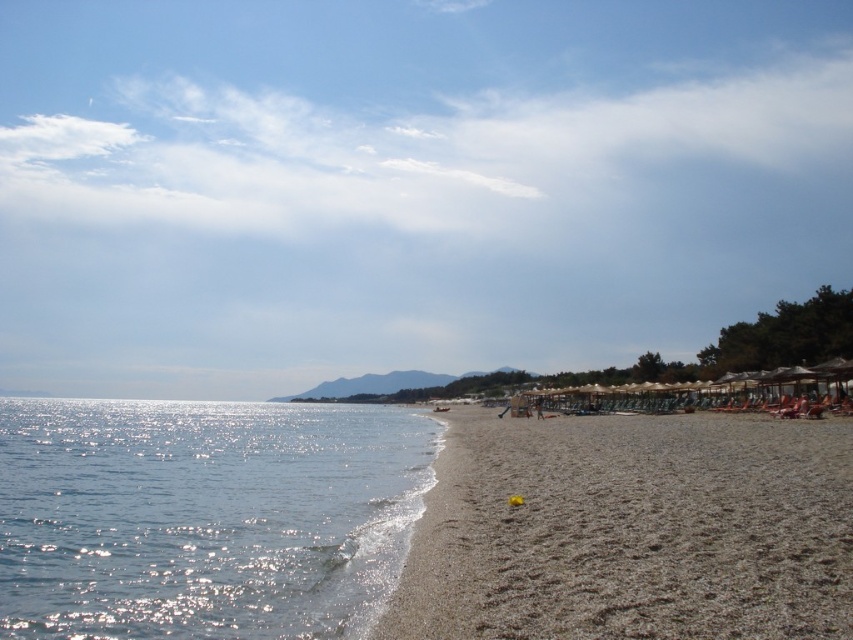
Question: Does blue sky at upper center have a larger size compared to shiny blue water at lower left?

Choices:
 (A) yes
 (B) no

Answer: (A)

Question: Is shiny blue water at lower left bigger than brown sandy beach at lower right?

Choices:
 (A) yes
 (B) no

Answer: (A)

Question: Can you confirm if blue sky at upper center is positioned above shiny blue water at lower left?

Choices:
 (A) no
 (B) yes

Answer: (B)

Question: Estimate the real-world distances between objects in this image. Which object is farther from the shiny blue water at lower left?

Choices:
 (A) blue sky at upper center
 (B) brown sandy beach at lower right

Answer: (A)

Question: Which point is farther from the camera taking this photo?

Choices:
 (A) (276, 600)
 (B) (672, 76)

Answer: (B)

Question: Which of the following is the farthest from the observer?

Choices:
 (A) shiny blue water at lower left
 (B) blue sky at upper center
 (C) brown sandy beach at lower right

Answer: (B)